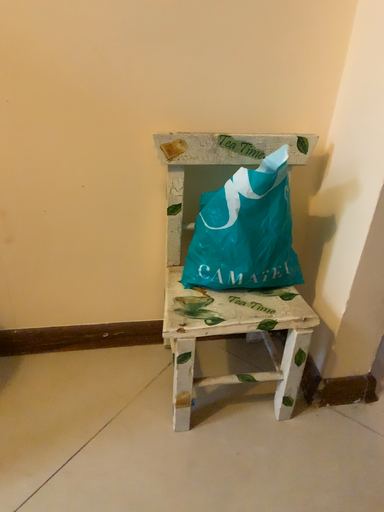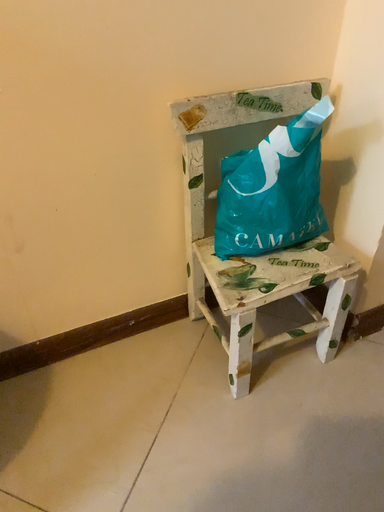
Question: Which way did the camera rotate in the video?

Choices:
 (A) rotated right
 (B) rotated left

Answer: (A)